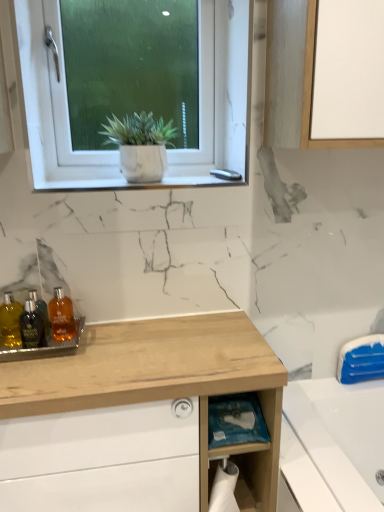
Find the location of a particular element. spots to the right of shiny glass bottles at left, the first toiletry in the left-to-right sequence is located at coordinates (97, 346).